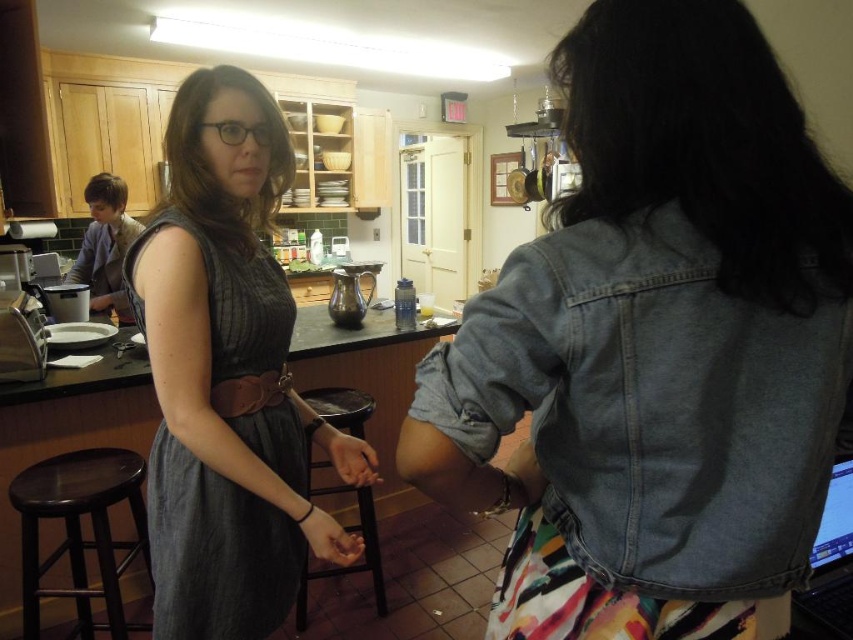
Describe the element at coordinates (80, 532) in the screenshot. The height and width of the screenshot is (640, 853). I see `dark brown wood stool at lower left` at that location.

Is dark brown wood stool at lower left thinner than smooth skin hand at center?

No, dark brown wood stool at lower left is not thinner than smooth skin hand at center.

Is point (74, 580) positioned after point (367, 449)?

Yes, point (74, 580) is behind point (367, 449).

This screenshot has height=640, width=853. Find the location of `dark brown wood stool at lower left`. dark brown wood stool at lower left is located at coordinates [80, 532].

Can you confirm if black glossy laptop at lower right is positioned below black wood stool at center?

Incorrect, black glossy laptop at lower right is not positioned below black wood stool at center.

Does black glossy laptop at lower right appear on the left side of black wood stool at center?

Incorrect, black glossy laptop at lower right is not on the left side of black wood stool at center.

The width and height of the screenshot is (853, 640). Identify the location of black glossy laptop at lower right. (830, 566).

Find the location of `black glossy laptop at lower right`. black glossy laptop at lower right is located at coordinates (830, 566).

From the picture: Is denim jacket at upper right smaller than brown leather belt at center?

No.

Does denim jacket at upper right appear under brown leather belt at center?

No.

Is point (734, 120) positioned in front of point (274, 384)?

Yes, point (734, 120) is closer to viewer.

The image size is (853, 640). Identify the location of denim jacket at upper right. (654, 342).